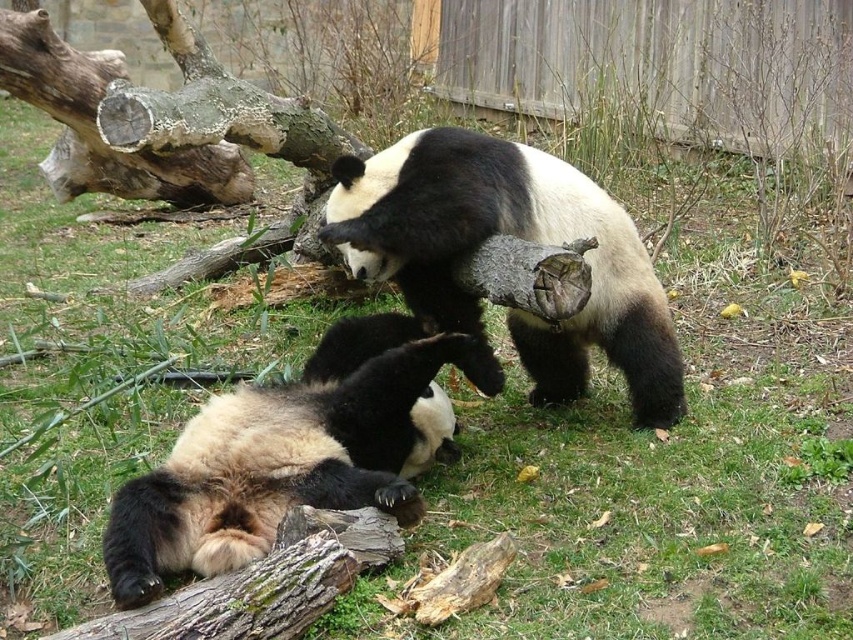
Question: Does black and white fur at center appear under brown rough bark tree trunk at upper left?

Choices:
 (A) yes
 (B) no

Answer: (A)

Question: Among these objects, which one is farthest from the camera?

Choices:
 (A) brown rough bark tree trunk at upper left
 (B) black and white fur at center
 (C) soft fur panda at lower left

Answer: (A)

Question: Estimate the real-world distances between objects in this image. Which object is farther from the black and white fur at center?

Choices:
 (A) brown rough bark tree trunk at upper left
 (B) soft fur panda at lower left

Answer: (A)

Question: Can you confirm if soft fur panda at lower left is positioned to the left of black and white fur at center?

Choices:
 (A) yes
 (B) no

Answer: (A)

Question: Is black and white fur at center wider than brown rough bark tree trunk at upper left?

Choices:
 (A) no
 (B) yes

Answer: (B)

Question: Among these points, which one is farthest from the camera?

Choices:
 (A) click(389, 264)
 (B) click(15, 65)

Answer: (B)